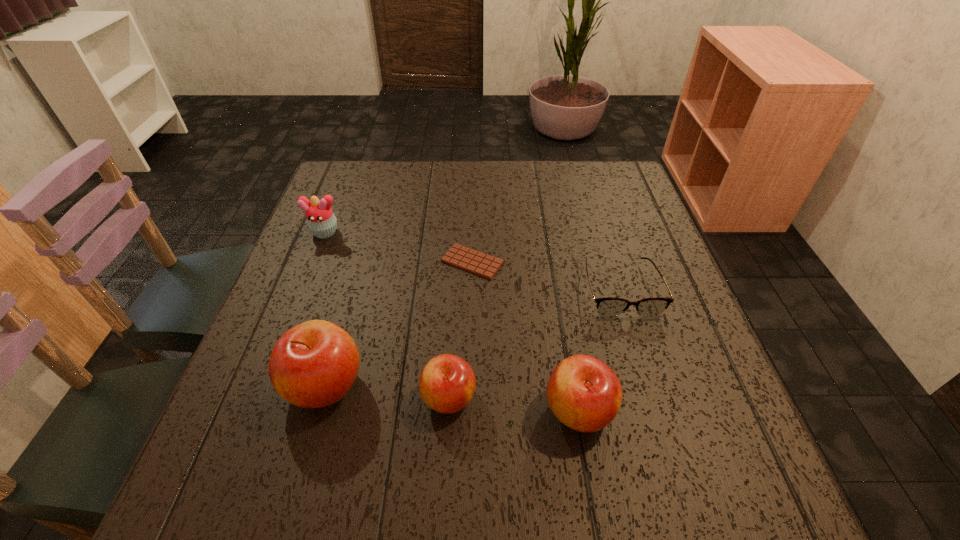
Find the location of a particular element. The image size is (960, 540). the leftmost apple is located at coordinates (314, 364).

What are the coordinates of `the tallest apple` in the screenshot? It's located at (314, 364).

Locate an element on the screen. This screenshot has width=960, height=540. the third shortest object is located at coordinates (447, 383).

This screenshot has width=960, height=540. I want to click on the shortest apple, so click(x=447, y=383).

Locate an element on the screen. This screenshot has width=960, height=540. the rightmost apple is located at coordinates (584, 393).

Locate an element on the screen. This screenshot has height=540, width=960. the fifth tallest object is located at coordinates tap(610, 306).

Where is `the farthest object`? the farthest object is located at coordinates (321, 221).

Identify the location of the shortest object. The image size is (960, 540). (478, 263).

You are a GUI agent. You are given a task and a screenshot of the screen. Output one action in this format:
    pyautogui.click(x=<x>, y=<y>)
    Task: Click on the free space located 0.140m on the back of the tallest apple
    
    Given the screenshot: What is the action you would take?
    pyautogui.click(x=349, y=299)

Where is `vacant space located 0.220m on the right of the second apple from right to left`? This screenshot has height=540, width=960. vacant space located 0.220m on the right of the second apple from right to left is located at coordinates (599, 397).